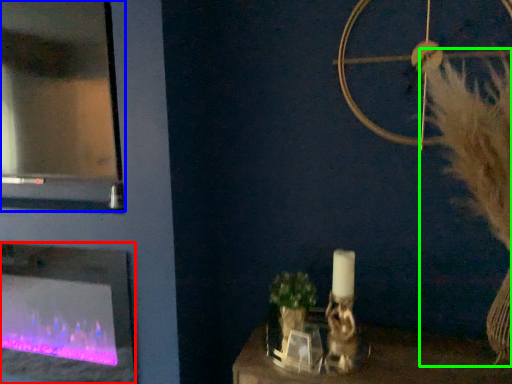
Question: Which object is positioned closest to fireplace (highlighted by a red box)? Select from glass door (highlighted by a blue box) and fur (highlighted by a green box).

Choices:
 (A) glass door
 (B) fur

Answer: (A)